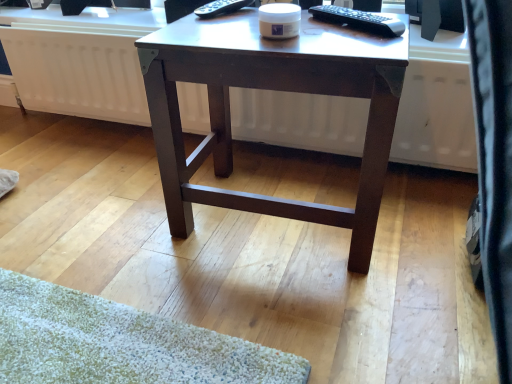
Where is `vacant area that lies between dark brown wood desk at center and white matte radiator at center`? The height and width of the screenshot is (384, 512). vacant area that lies between dark brown wood desk at center and white matte radiator at center is located at coordinates (124, 163).